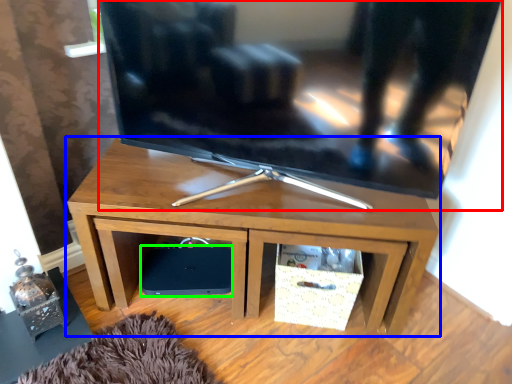
Question: Based on their relative distances, which object is farther from television (highlighted by a red box)? Choose from desk (highlighted by a blue box) and speaker (highlighted by a green box).

Choices:
 (A) desk
 (B) speaker

Answer: (B)